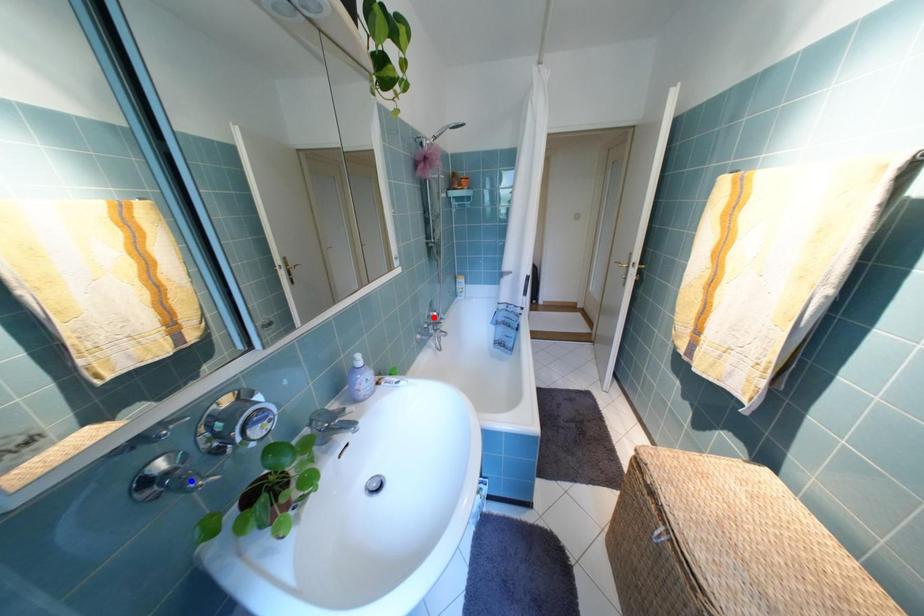
Question: Which of the two points in the image is closer to the camera?

Choices:
 (A) Blue point is closer.
 (B) Red point is closer.

Answer: (A)